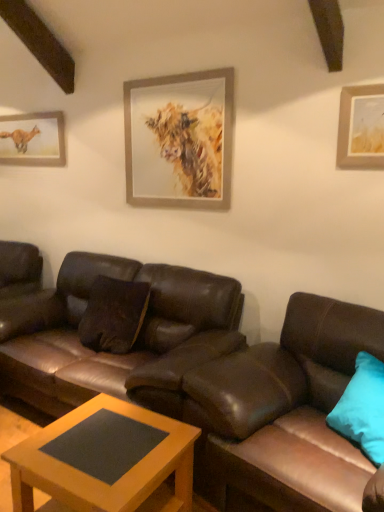
You are a GUI agent. You are given a task and a screenshot of the screen. Output one action in this format:
    pyautogui.click(x=<x>, y=<y>)
    Task: Click on the teal fabric pillow at right
    This screenshot has width=384, height=512.
    Given the screenshot: What is the action you would take?
    pyautogui.click(x=363, y=408)

What is the approximate height of wooden matte coffee table at center?

The height of wooden matte coffee table at center is 18.66 inches.

The image size is (384, 512). Identify the location of brown leather couch at lower right, the second studio couch in the left-to-right sequence. (285, 411).

How much space does brown leather couch at lower right, the second studio couch in the left-to-right sequence, occupy vertically?

38.47 inches.

Describe the element at coordinates (110, 353) in the screenshot. I see `brown leather couch at center, which is the first studio couch from left to right` at that location.

This screenshot has height=512, width=384. In order to click on brown leather couch at center, which is the first studio couch from left to right in this screenshot , I will do `click(110, 353)`.

Identify the location of wooden-framed painting of a cow at upper center, marked as the first picture frame in a front-to-back arrangement. (180, 140).

Relative to wooden matte coffee table at center, is brown leather couch at center, which is the first studio couch from left to right, in front or behind?

Visually, brown leather couch at center, which is the first studio couch from left to right, is located behind wooden matte coffee table at center.

Is brown leather couch at center, which is the first studio couch from left to right, located outside wooden matte coffee table at center?

That's correct, brown leather couch at center, which is the first studio couch from left to right, is outside of wooden matte coffee table at center.

Between brown leather couch at center, which is the first studio couch from left to right, and wooden matte coffee table at center, which one has larger size?

With larger size is brown leather couch at center, which is the first studio couch from left to right.

In the scene shown: Is brown leather couch at center, which is the first studio couch from left to right, turned away from wooden matte coffee table at center?

No, wooden matte coffee table at center is not at the back of brown leather couch at center, which is the first studio couch from left to right.

Which object is positioned more to the right, teal fabric pillow at right or matte paper picture frame at upper left, marked as the first picture frame in a back-to-front arrangement?

Positioned to the right is teal fabric pillow at right.

From a real-world perspective, is teal fabric pillow at right positioned above or below matte paper picture frame at upper left, marked as the first picture frame in a back-to-front arrangement?

In terms of real-world spatial position, teal fabric pillow at right is below matte paper picture frame at upper left, marked as the first picture frame in a back-to-front arrangement.

Where is `pillow located underneath the matte paper picture frame at upper left, which appears as the first picture frame when viewed from the left (from a real-world perspective)`? pillow located underneath the matte paper picture frame at upper left, which appears as the first picture frame when viewed from the left (from a real-world perspective) is located at coordinates (363, 408).

What's the angular difference between teal fabric pillow at right and matte paper picture frame at upper left, which appears as the first picture frame when viewed from the left,'s facing directions?

teal fabric pillow at right and matte paper picture frame at upper left, which appears as the first picture frame when viewed from the left, are facing 32.2 degrees away from each other.

Image resolution: width=384 pixels, height=512 pixels. I want to click on studio couch in front of the brown leather couch at center, which is the first studio couch from left to right, so click(x=285, y=411).

Is brown leather couch at center, which is the first studio couch from left to right, in front of brown leather couch at lower right, arranged as the first studio couch when viewed from the right?

No, it is not.

Does brown leather couch at center, which is the first studio couch from left to right, turn towards brown leather couch at lower right, arranged as the first studio couch when viewed from the right?

No.

Considering the sizes of brown leather couch at center, which ranks as the second studio couch in right-to-left order, and brown leather couch at lower right, the second studio couch in the left-to-right sequence, in the image, is brown leather couch at center, which ranks as the second studio couch in right-to-left order, taller or shorter than brown leather couch at lower right, the second studio couch in the left-to-right sequence,?

Clearly, brown leather couch at center, which ranks as the second studio couch in right-to-left order, is taller compared to brown leather couch at lower right, the second studio couch in the left-to-right sequence.

How different are the orientations of wooden-framed painting of a cow at upper center, marked as the first picture frame in a front-to-back arrangement, and teal fabric pillow at right in degrees?

The angle between the facing direction of wooden-framed painting of a cow at upper center, marked as the first picture frame in a front-to-back arrangement, and the facing direction of teal fabric pillow at right is 32.2 degrees.

In the scene shown: From the image's perspective, does wooden-framed painting of a cow at upper center, the first picture frame positioned from the right, appear higher than teal fabric pillow at right?

Correct, wooden-framed painting of a cow at upper center, the first picture frame positioned from the right, appears higher than teal fabric pillow at right in the image.

Is wooden-framed painting of a cow at upper center, marked as the first picture frame in a front-to-back arrangement, positioned with its back to teal fabric pillow at right?

No, wooden-framed painting of a cow at upper center, marked as the first picture frame in a front-to-back arrangement,'s orientation is not away from teal fabric pillow at right.

Between wooden matte coffee table at center and brown leather couch at lower right, the second studio couch in the left-to-right sequence, which one has larger size?

With larger size is brown leather couch at lower right, the second studio couch in the left-to-right sequence.

Does wooden matte coffee table at center appear on the left side of brown leather couch at lower right, arranged as the first studio couch when viewed from the right?

Correct, you'll find wooden matte coffee table at center to the left of brown leather couch at lower right, arranged as the first studio couch when viewed from the right.

How many degrees apart are the facing directions of wooden matte coffee table at center and brown leather couch at lower right, the second studio couch in the left-to-right sequence?

13.9 degrees separate the facing orientations of wooden matte coffee table at center and brown leather couch at lower right, the second studio couch in the left-to-right sequence.

Consider the image. Is wooden matte coffee table at center oriented away from brown leather couch at lower right, arranged as the first studio couch when viewed from the right?

No, wooden matte coffee table at center's orientation is not away from brown leather couch at lower right, arranged as the first studio couch when viewed from the right.

Identify the location of picture frame that is the 2nd object above the brown leather couch at center, which ranks as the second studio couch in right-to-left order (from a real-world perspective). (33, 139).

Is matte paper picture frame at upper left, acting as the second picture frame starting from the front, not inside brown leather couch at center, which ranks as the second studio couch in right-to-left order?

Yes.

From the picture: Which is more to the left, matte paper picture frame at upper left, marked as the first picture frame in a back-to-front arrangement, or brown leather couch at center, which ranks as the second studio couch in right-to-left order?

matte paper picture frame at upper left, marked as the first picture frame in a back-to-front arrangement.

From a real-world perspective, which is physically above, matte paper picture frame at upper left, acting as the second picture frame starting from the front, or brown leather couch at center, which ranks as the second studio couch in right-to-left order?

matte paper picture frame at upper left, acting as the second picture frame starting from the front, from a real-world perspective.

Which of these two, matte paper picture frame at upper left, which appears as the first picture frame when viewed from the left, or teal fabric pillow at right, stands shorter?

With less height is matte paper picture frame at upper left, which appears as the first picture frame when viewed from the left.

Is matte paper picture frame at upper left, which ranks as the 2th picture frame in right-to-left order, in front of or behind teal fabric pillow at right in the image?

Clearly, matte paper picture frame at upper left, which ranks as the 2th picture frame in right-to-left order, is behind teal fabric pillow at right.

Which is nearer, (62, 115) or (333, 419)?

The point (333, 419) is more forward.

From a real-world perspective, which studio couch is the 2nd one above the wooden matte coffee table at center? Please provide its 2D coordinates.

[(110, 353)]

This screenshot has height=512, width=384. Identify the location of pillow to the right of matte paper picture frame at upper left, marked as the first picture frame in a back-to-front arrangement. (363, 408).

Estimate the real-world distances between objects in this image. Which object is closer to wooden-framed painting of a cow at upper center, marked as the first picture frame in a front-to-back arrangement, matte paper picture frame at upper left, marked as the first picture frame in a back-to-front arrangement, or wooden matte coffee table at center?

matte paper picture frame at upper left, marked as the first picture frame in a back-to-front arrangement.

Considering their positions, is teal fabric pillow at right positioned closer to matte paper picture frame at upper left, acting as the second picture frame starting from the front, than wooden-framed painting of a cow at upper center, which is the 2th picture frame from back to front?

wooden-framed painting of a cow at upper center, which is the 2th picture frame from back to front, is positioned closer to the anchor matte paper picture frame at upper left, acting as the second picture frame starting from the front.

Based on the photo, from the image, which object appears to be nearer to teal fabric pillow at right, wooden-framed painting of a cow at upper center, which is the 2th picture frame from left to right, or brown leather couch at lower right, arranged as the first studio couch when viewed from the right?

Based on the image, brown leather couch at lower right, arranged as the first studio couch when viewed from the right, appears to be nearer to teal fabric pillow at right.

Estimate the real-world distances between objects in this image. Which object is further from wooden matte coffee table at center, wooden-framed painting of a cow at upper center, the first picture frame positioned from the right, or brown leather couch at center, which is the first studio couch from left to right?

wooden-framed painting of a cow at upper center, the first picture frame positioned from the right, lies further to wooden matte coffee table at center than the other object.

Looking at the image, which one is located further to brown leather couch at center, which ranks as the second studio couch in right-to-left order, matte paper picture frame at upper left, which appears as the first picture frame when viewed from the left, or teal fabric pillow at right?

matte paper picture frame at upper left, which appears as the first picture frame when viewed from the left.

Based on their spatial positions, is wooden matte coffee table at center or wooden-framed painting of a cow at upper center, the first picture frame positioned from the right, closer to teal fabric pillow at right?

wooden matte coffee table at center is closer to teal fabric pillow at right.

Looking at the image, which one is located closer to matte paper picture frame at upper left, marked as the first picture frame in a back-to-front arrangement, teal fabric pillow at right or brown leather couch at lower right, arranged as the first studio couch when viewed from the right?

Among the two, brown leather couch at lower right, arranged as the first studio couch when viewed from the right, is located nearer to matte paper picture frame at upper left, marked as the first picture frame in a back-to-front arrangement.

Considering their positions, is wooden matte coffee table at center positioned closer to teal fabric pillow at right than matte paper picture frame at upper left, which ranks as the 2th picture frame in right-to-left order?

Based on the image, wooden matte coffee table at center appears to be nearer to teal fabric pillow at right.

I want to click on studio couch located between wooden matte coffee table at center and teal fabric pillow at right in the left-right direction, so click(285, 411).

Identify the location of picture frame between matte paper picture frame at upper left, which ranks as the 2th picture frame in right-to-left order, and brown leather couch at center, which is the first studio couch from left to right, vertically. Image resolution: width=384 pixels, height=512 pixels. (180, 140).

The width and height of the screenshot is (384, 512). What are the coordinates of `pillow between wooden-framed painting of a cow at upper center, which is the 2th picture frame from left to right, and wooden matte coffee table at center in the up-down direction` in the screenshot? It's located at (363, 408).

Where is `picture frame situated between matte paper picture frame at upper left, which ranks as the 2th picture frame in right-to-left order, and teal fabric pillow at right from left to right`? Image resolution: width=384 pixels, height=512 pixels. picture frame situated between matte paper picture frame at upper left, which ranks as the 2th picture frame in right-to-left order, and teal fabric pillow at right from left to right is located at coordinates (180, 140).